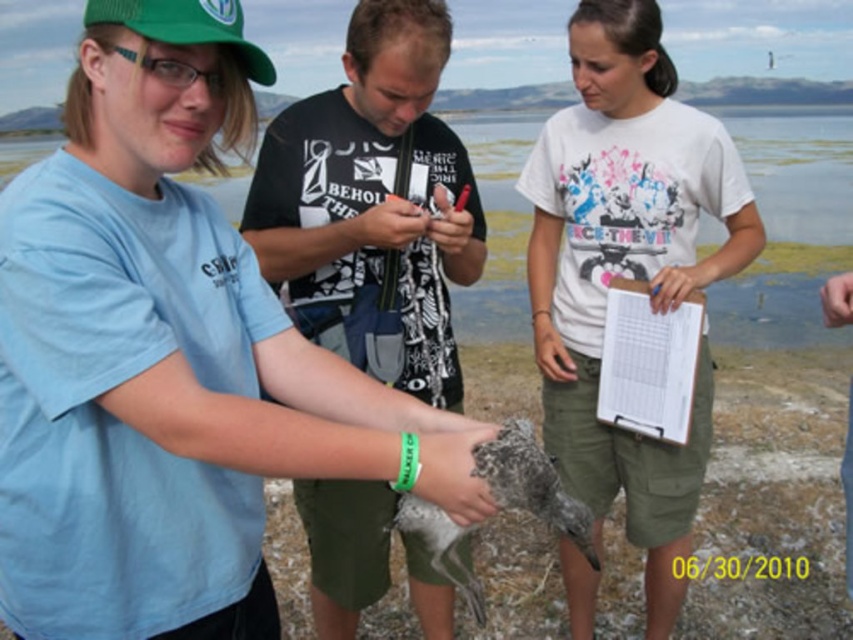
Question: Does clear water at center lie behind green fabric baseball cap at upper left?

Choices:
 (A) no
 (B) yes

Answer: (B)

Question: Is white matte shirt at center bigger than white paper clipboard at center?

Choices:
 (A) no
 (B) yes

Answer: (B)

Question: Is clear water at center wider than green fabric baseball cap at upper left?

Choices:
 (A) no
 (B) yes

Answer: (B)

Question: Among these points, which one is nearest to the camera?

Choices:
 (A) (813, 157)
 (B) (595, 275)

Answer: (B)

Question: Which of the following is the closest to the observer?

Choices:
 (A) (260, 193)
 (B) (498, 157)

Answer: (A)

Question: Which is nearer to the white paper clipboard at center?

Choices:
 (A) white matte shirt at center
 (B) green fabric baseball cap at upper left

Answer: (A)